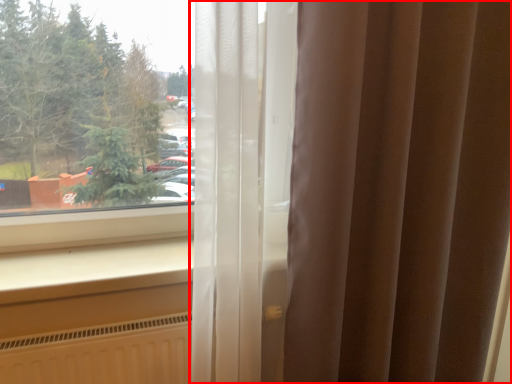
Question: From the image's perspective, where is curtain (annotated by the red box) located relative to window sill?

Choices:
 (A) below
 (B) above

Answer: (B)